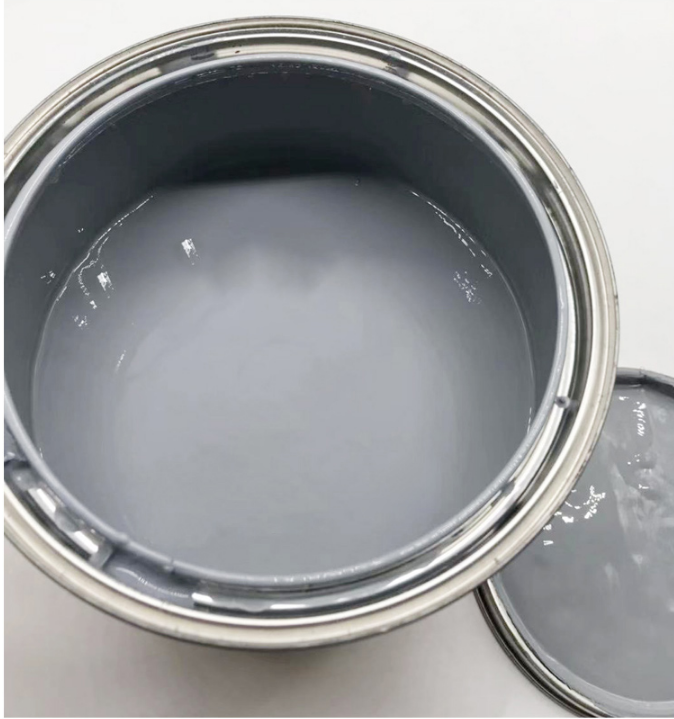
The height and width of the screenshot is (719, 674). What are the coordinates of `gray paint` in the screenshot? It's located at (151, 438).